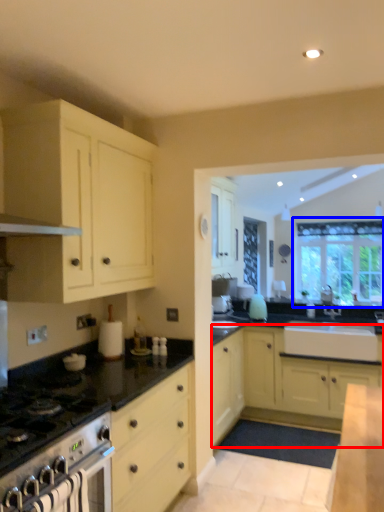
Question: Which object is closer to the camera taking this photo, cabinetry (highlighted by a red box) or window (highlighted by a blue box)?

Choices:
 (A) cabinetry
 (B) window

Answer: (A)